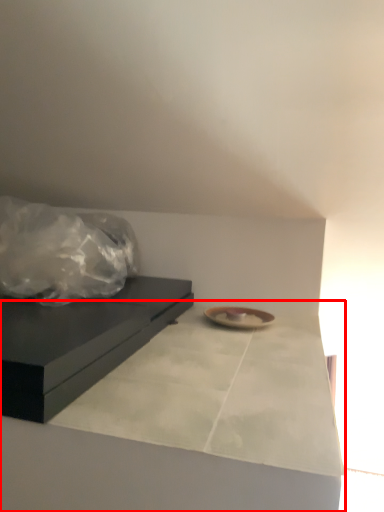
Question: From the image's perspective, what is the correct spatial positioning of counter top (annotated by the red box) in reference to table?

Choices:
 (A) above
 (B) below

Answer: (B)